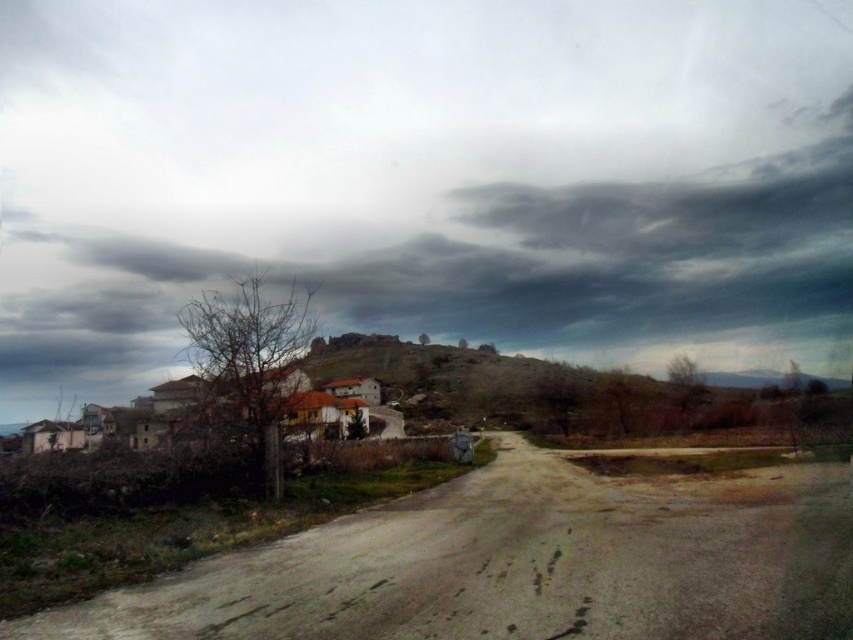
You are an airplane pilot flying over the rural landscape described in the scene. You notice the dark gray cloud at upper center and the brown stone hill at center. Which one appears wider from your aerial view?

The dark gray cloud at upper center appears wider than the brown stone hill at center because its width surpasses that of the hill.

You are standing on the dirt road in the rural landscape. Looking up, you see the dark gray cloud at upper center and the brown stone hill at center. Which object is positioned higher in the sky?

The dark gray cloud at upper center is positioned higher in the sky than the brown stone hill at center because the cloud is above the hill according to the description.